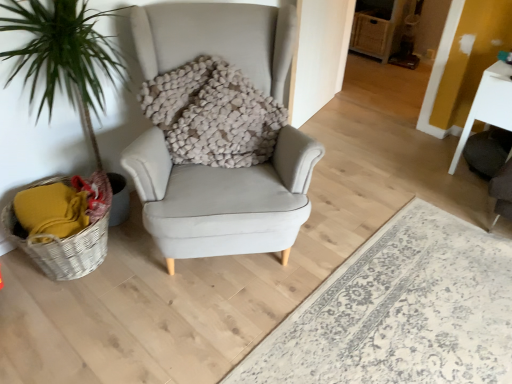
Question: Does fuzzy beige pillow at center lie in front of woven wicker basket at lower left?

Choices:
 (A) yes
 (B) no

Answer: (B)

Question: Is fuzzy beige pillow at center in contact with woven wicker basket at lower left?

Choices:
 (A) yes
 (B) no

Answer: (B)

Question: Are fuzzy beige pillow at center and woven wicker basket at lower left far apart?

Choices:
 (A) no
 (B) yes

Answer: (A)

Question: Is fuzzy beige pillow at center at the right side of woven wicker basket at lower left?

Choices:
 (A) yes
 (B) no

Answer: (A)

Question: From a real-world perspective, does fuzzy beige pillow at center stand above woven wicker basket at lower left?

Choices:
 (A) no
 (B) yes

Answer: (B)

Question: Is woven wicker basket at lower left located within fuzzy beige pillow at center?

Choices:
 (A) yes
 (B) no

Answer: (B)

Question: Can you confirm if light gray fabric armchair at center is thinner than fuzzy beige pillow at center?

Choices:
 (A) yes
 (B) no

Answer: (B)

Question: Considering the relative positions of light gray fabric armchair at center and fuzzy beige pillow at center in the image provided, is light gray fabric armchair at center to the right of fuzzy beige pillow at center from the viewer's perspective?

Choices:
 (A) yes
 (B) no

Answer: (A)

Question: From a real-world perspective, is light gray fabric armchair at center located higher than fuzzy beige pillow at center?

Choices:
 (A) yes
 (B) no

Answer: (B)

Question: Is light gray fabric armchair at center far from fuzzy beige pillow at center?

Choices:
 (A) no
 (B) yes

Answer: (A)

Question: Is light gray fabric armchair at center oriented towards fuzzy beige pillow at center?

Choices:
 (A) yes
 (B) no

Answer: (B)

Question: Does light gray fabric armchair at center lie behind fuzzy beige pillow at center?

Choices:
 (A) yes
 (B) no

Answer: (B)

Question: Can you confirm if woven wicker basket at lower left is thinner than white glossy table at right?

Choices:
 (A) yes
 (B) no

Answer: (A)